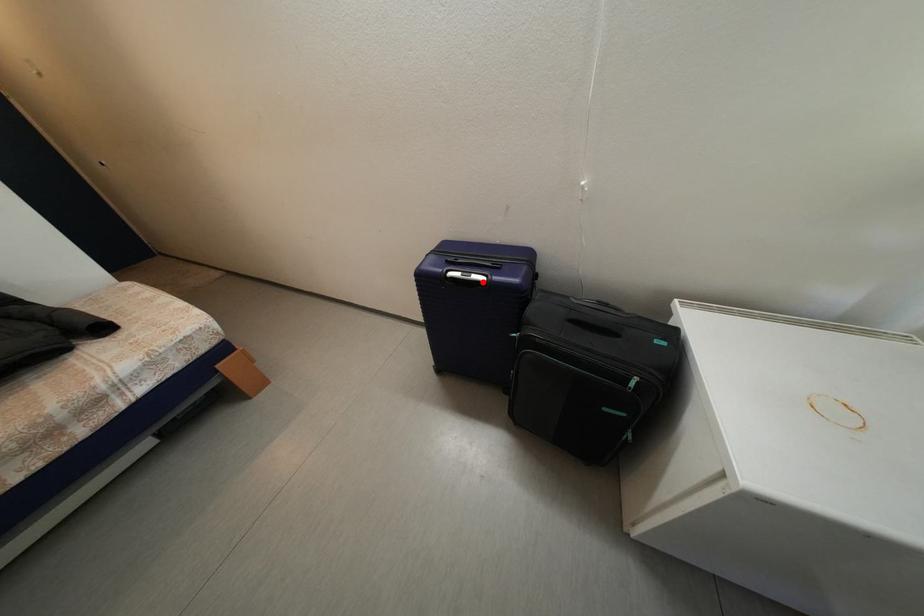
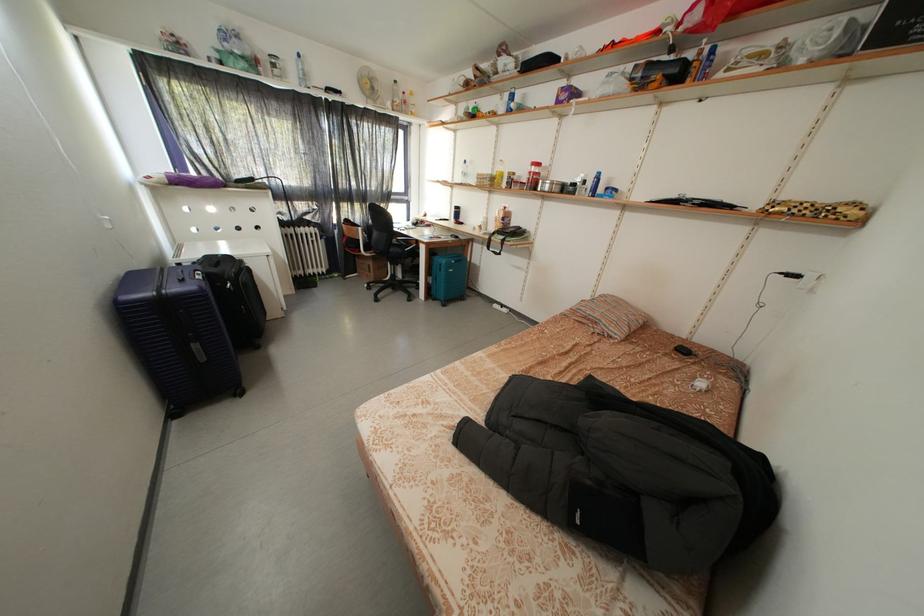
Find the pixel in the second image that matches the highlighted location in the first image.

(208, 280)